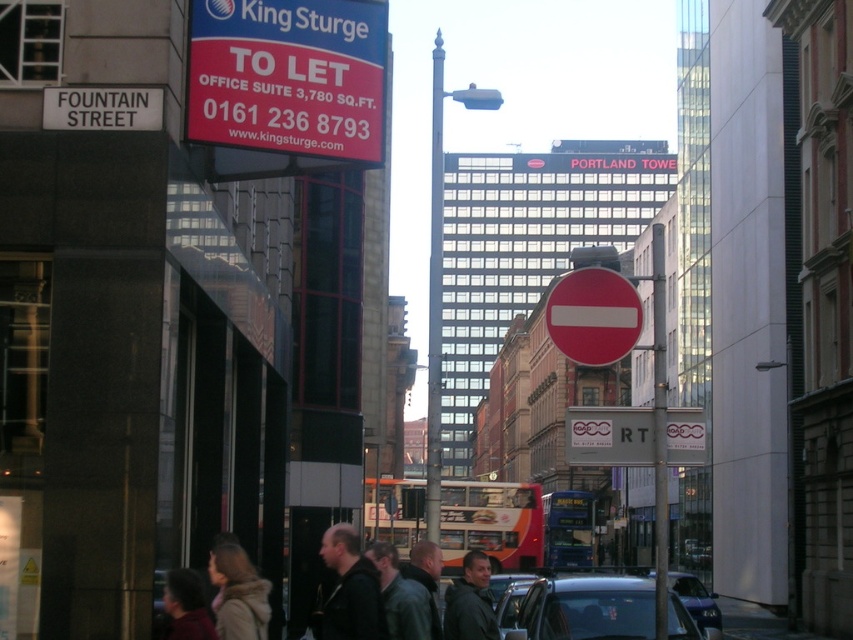
From the picture: Is metallic silver car at center to the right of dark gray jacket at center from the viewer's perspective?

Indeed, metallic silver car at center is positioned on the right side of dark gray jacket at center.

Which of these two, metallic silver car at center or dark gray jacket at center, stands shorter?

metallic silver car at center is shorter.

Is point (637, 624) farther from camera compared to point (335, 586)?

Yes, it is behind point (335, 586).

Identify the location of metallic silver car at center. (585, 609).

Between point (276, 49) and point (428, 500), which one is positioned behind?

The point (428, 500) is behind.

Looking at this image, is matte plastic sign at upper left thinner than polished metal pole at center?

Indeed, matte plastic sign at upper left has a lesser width compared to polished metal pole at center.

Between point (344, 77) and point (442, 38), which one is positioned behind?

The point (442, 38) is behind.

The image size is (853, 640). I want to click on matte plastic sign at upper left, so click(x=287, y=84).

Which of these two, white and orange painted double-decker bus at center or red matte circle at center, stands shorter?

red matte circle at center

Is white and orange painted double-decker bus at center thinner than red matte circle at center?

Incorrect, white and orange painted double-decker bus at center's width is not less than red matte circle at center's.

Is point (444, 552) positioned in front of point (619, 330)?

No, it is behind (619, 330).

Identify the location of white and orange painted double-decker bus at center. This screenshot has height=640, width=853. [x=491, y=524].